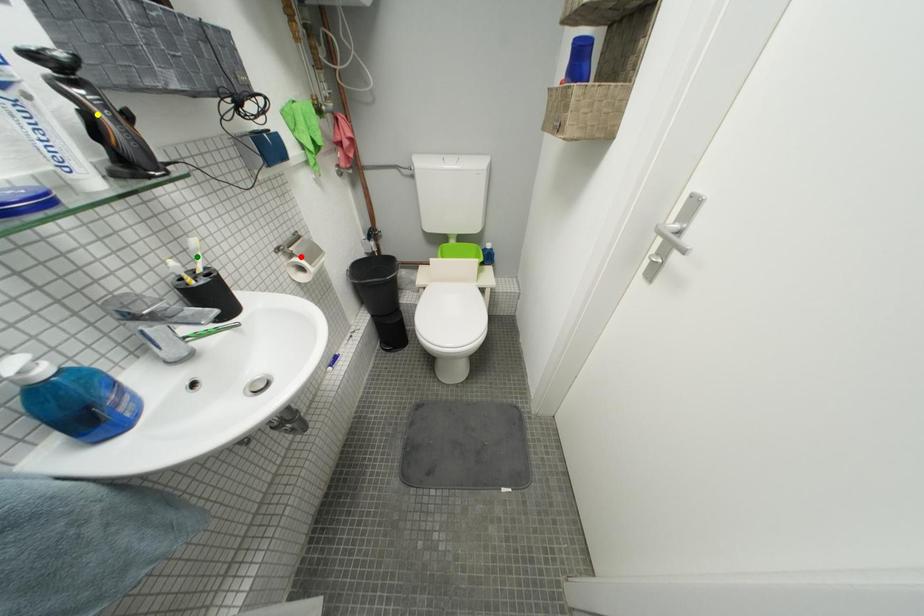
Order these from farthest to nearest:
green point
red point
yellow point

red point → green point → yellow point